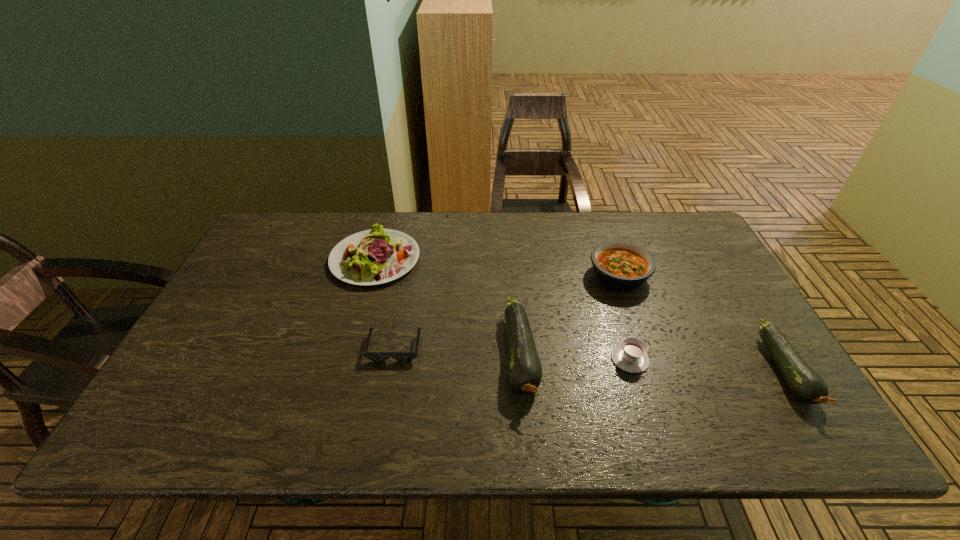
Find the location of a particular element. The image size is (960, 540). vacant space located 0.350m on the handle side of the second shortest object is located at coordinates (598, 256).

This screenshot has height=540, width=960. In order to click on free space located on the handle side of the second shortest object in this screenshot , I will do `click(597, 254)`.

You are a GUI agent. You are given a task and a screenshot of the screen. Output one action in this format:
    pyautogui.click(x=<x>, y=<y>)
    Task: Click on the free space located on the handle side of the second shortest object
    The height and width of the screenshot is (540, 960).
    Given the screenshot: What is the action you would take?
    pyautogui.click(x=617, y=318)

The height and width of the screenshot is (540, 960). I want to click on vacant position located 0.110m on the front-facing side of the sunglasses, so click(x=385, y=402).

Identify the location of object located in the far edge section of the desktop. Image resolution: width=960 pixels, height=540 pixels. (375, 256).

Find the location of a particular element. This screenshot has width=960, height=540. teacup that is at the near edge is located at coordinates (630, 356).

This screenshot has width=960, height=540. I want to click on object that is positioned at the right edge, so click(x=806, y=384).

This screenshot has width=960, height=540. In order to click on object located in the near right corner section of the desktop in this screenshot , I will do `click(806, 384)`.

This screenshot has height=540, width=960. In the image, there is a desktop. What are the coordinates of `vacant space at the far edge` in the screenshot? It's located at (527, 248).

Locate an element on the screen. vacant space at the near edge of the desktop is located at coordinates (594, 401).